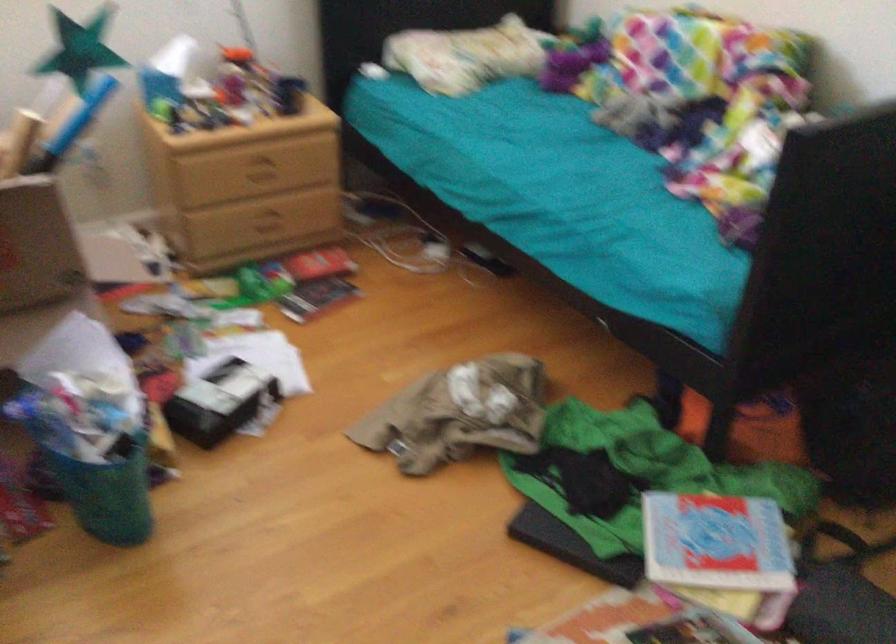
The location [107,494] corresponds to which object?

It refers to a green round container.